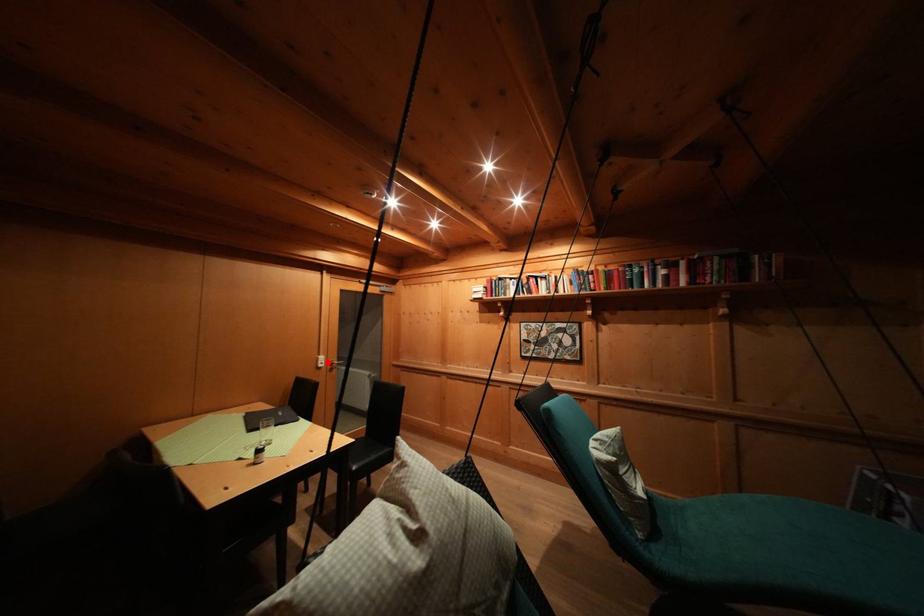
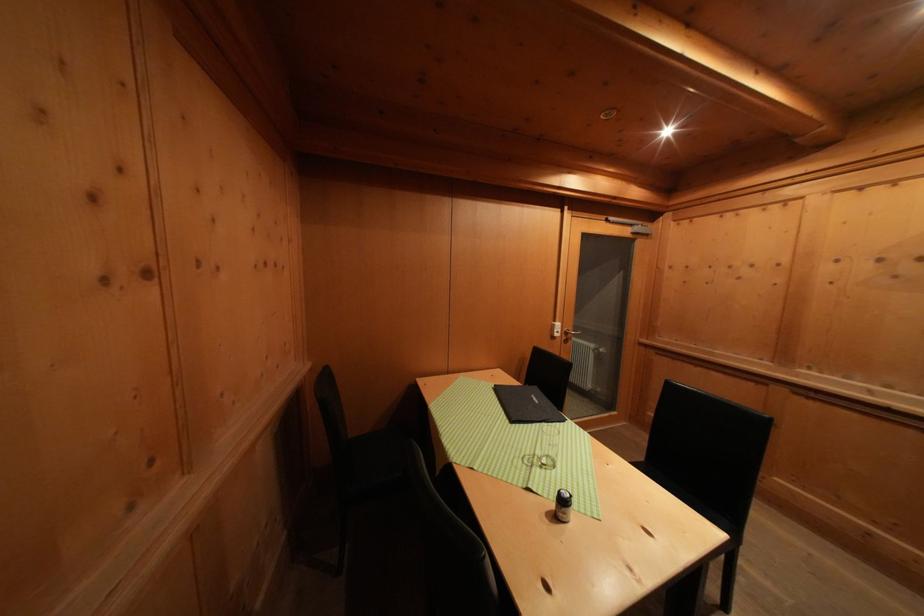
The point at the highlighted location is marked in the first image. Where is the corresponding point in the second image?

(564, 330)